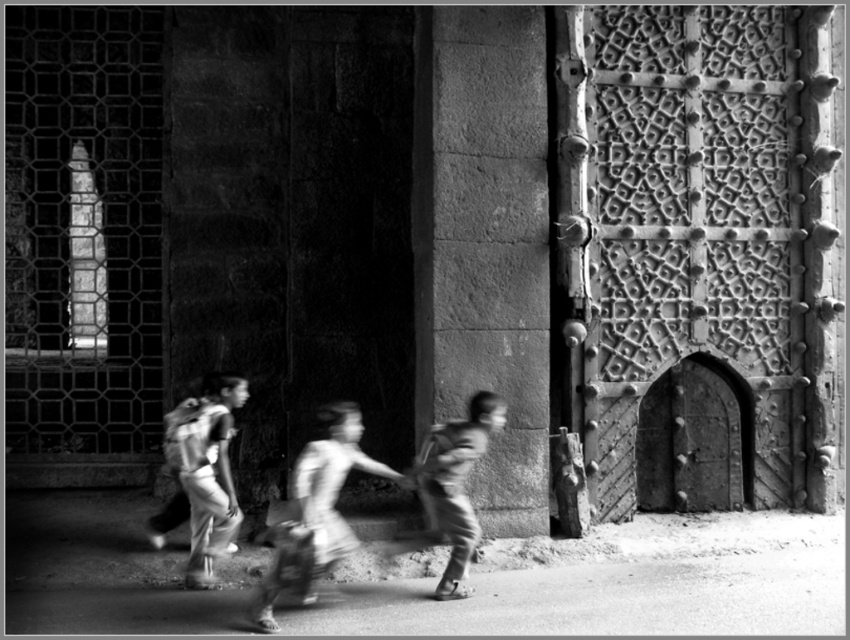
You are a photographer trying to capture the scene with a camera that has a limited height adjustment. The camera can only focus on objects up to the height of the smooth skin boy at center. Will the rough stone pillar at center be fully visible in your photo?

The rough stone pillar at center is taller than the smooth skin boy at center, so the top part of the pillar will not be fully visible in the photo since the camera can only focus up to the boy s height.

You are a delivery person trying to deliver a package to a client. You see a smooth fabric bag at center and a matte backpack at center. Which item is located to the right of the other?

The smooth fabric bag at center is positioned on the right side of matte backpack at center.

You are a photographer aiming to capture the smooth fabric bag at center and the rough stone pillar at center in a single frame. Based on their positions, can you tell which object is closer to the camera?

The rough stone pillar at center is located above the smooth fabric bag at center, so the smooth fabric bag at center is closer to the camera.